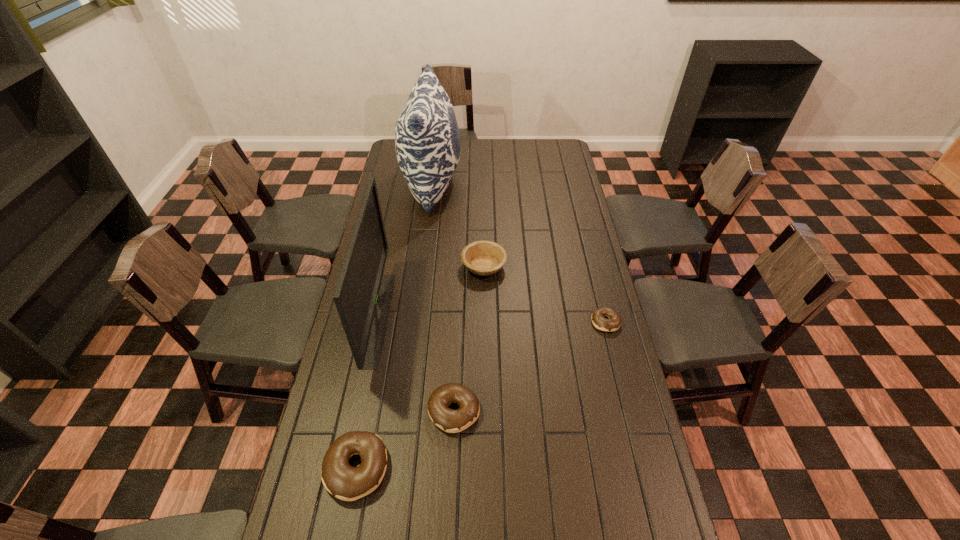
You are a GUI agent. You are given a task and a screenshot of the screen. Output one action in this format:
    pyautogui.click(x=<x>, y=<y>)
    Task: Click on the nearest doughnut
    
    Given the screenshot: What is the action you would take?
    [x=343, y=481]

Locate an element on the screen. Image resolution: width=960 pixels, height=540 pixels. the nearest object is located at coordinates point(343,481).

Where is `the fifth farthest object`? Image resolution: width=960 pixels, height=540 pixels. the fifth farthest object is located at coordinates (452, 421).

Locate an element on the screen. the second farthest doughnut is located at coordinates (452, 421).

The width and height of the screenshot is (960, 540). I want to click on the shortest object, so pos(599,321).

Where is `the shortest doughnut`? The image size is (960, 540). the shortest doughnut is located at coordinates (599, 321).

Where is `bowl`? The height and width of the screenshot is (540, 960). bowl is located at coordinates tap(483, 258).

The image size is (960, 540). I want to click on the farthest object, so click(x=427, y=140).

The height and width of the screenshot is (540, 960). What are the coordinates of `monitor` in the screenshot? It's located at (363, 294).

Locate an element on the screen. vacant space situated on the front of the leftmost doughnut is located at coordinates (344, 530).